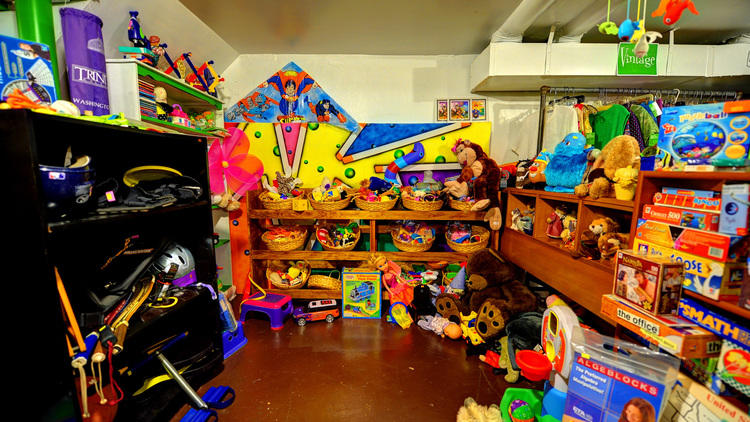
At what (x,y) coordinates should I click in order to perform the action: click on toy truck. Please return your answer as a coordinate pair (x, y). This screenshot has height=422, width=750. Looking at the image, I should click on (324, 307).